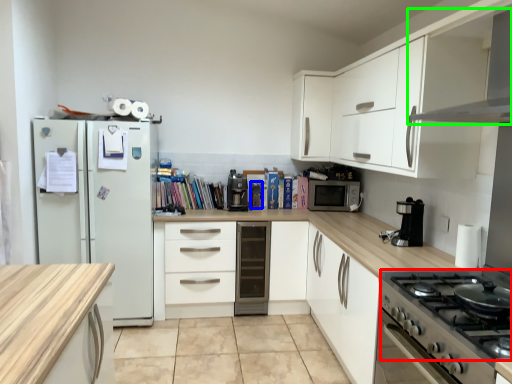
Question: Based on their relative distances, which object is nearer to gas stove (highlighted by a red box)? Choose from appliance (highlighted by a blue box) and exhaust hood (highlighted by a green box).

Choices:
 (A) appliance
 (B) exhaust hood

Answer: (B)